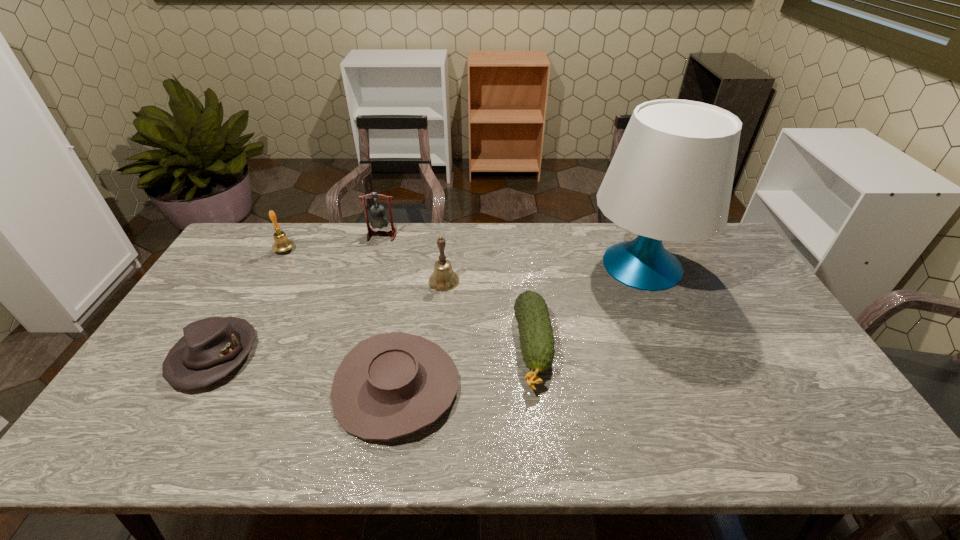
Locate an element on the screen. The height and width of the screenshot is (540, 960). vacant space located on the front-facing side of the table lamp is located at coordinates (476, 266).

You are a GUI agent. You are given a task and a screenshot of the screen. Output one action in this format:
    pyautogui.click(x=<x>, y=<y>)
    Task: Click on the vacant space located on the right of the second bell from right to left
    The height and width of the screenshot is (540, 960).
    Given the screenshot: What is the action you would take?
    pyautogui.click(x=464, y=235)

Image resolution: width=960 pixels, height=540 pixels. In order to click on vacant position located 0.100m on the front of the nearest bell in this screenshot , I will do `click(441, 314)`.

I want to click on free spot located 0.300m on the right of the leftmost bell, so click(x=380, y=250).

Identify the location of vacant space located 0.090m on the decorative side of the hat. This screenshot has width=960, height=540. (172, 429).

At what (x,y) coordinates should I click in order to perform the action: click on vacant position located 0.140m at the blossom end of the cucumber. Please return your answer as a coordinate pair (x, y). The image size is (960, 540). Looking at the image, I should click on (545, 451).

At what (x,y) coordinates should I click in order to perform the action: click on vacant space positioned 0.280m on the right of the cowboy hat. Please return your answer as a coordinate pair (x, y). Looking at the image, I should click on (568, 387).

This screenshot has width=960, height=540. Identify the location of table lamp at the far edge. (671, 177).

Locate an element on the screen. The image size is (960, 540). object that is at the near edge is located at coordinates (390, 385).

The width and height of the screenshot is (960, 540). In order to click on bell that is at the left edge in this screenshot , I will do `click(281, 243)`.